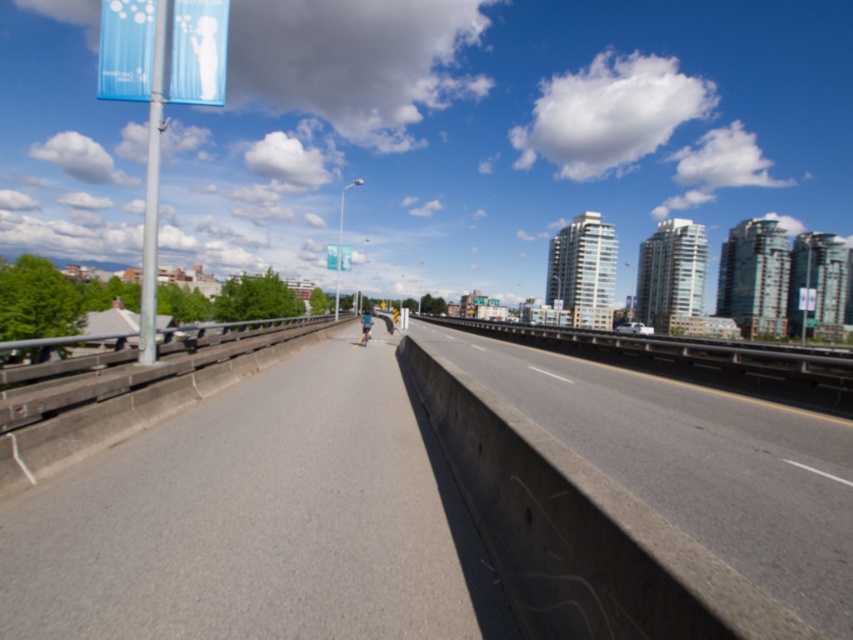
Question: In this image, where is gray asphalt highway at center located relative to white plastic traffic sign at center?

Choices:
 (A) above
 (B) below

Answer: (B)

Question: Does concrete at center have a larger size compared to white plastic traffic sign at center?

Choices:
 (A) no
 (B) yes

Answer: (A)

Question: Which object appears farthest from the camera in this image?

Choices:
 (A) gray asphalt highway at center
 (B) white plastic traffic sign at center

Answer: (B)

Question: Can you confirm if gray asphalt highway at center is bigger than white plastic traffic sign at center?

Choices:
 (A) yes
 (B) no

Answer: (B)

Question: Which of the following is the farthest from the observer?

Choices:
 (A) (648, 483)
 (B) (341, 264)
 (C) (474, 566)

Answer: (B)

Question: Which point is closer to the camera taking this photo?

Choices:
 (A) (334, 256)
 (B) (692, 518)
 (C) (227, 394)

Answer: (B)